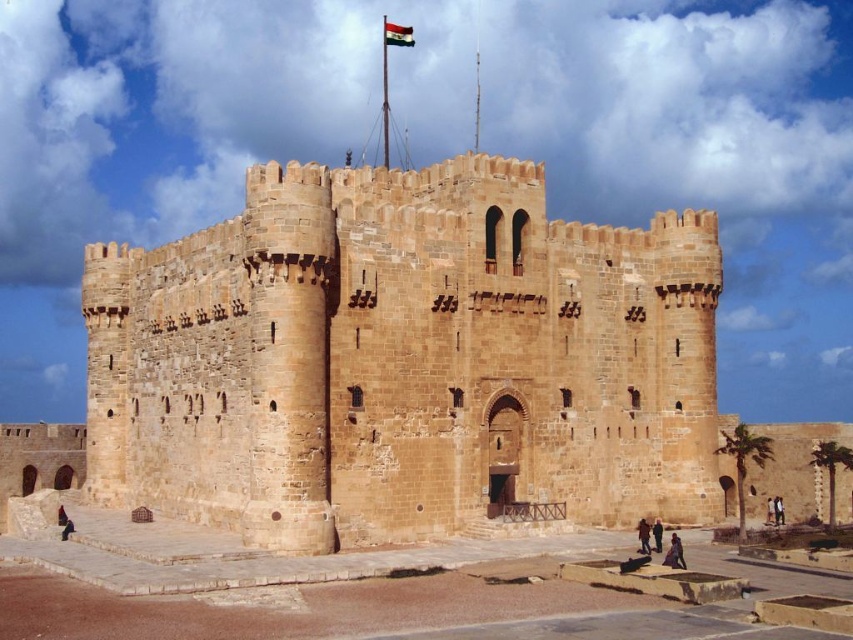
You are a visitor standing at the base of the fortress. You want to take a photo of the polyester flag at upper center without including the brown stone fort at center in the frame. Is this possible given their positions?

The brown stone fort at center is positioned on the right side of the polyester flag at upper center, so the fort is to the right of the flag. Since you want to exclude the fort from the photo, you can position yourself to the left side of the flag to capture it without the fort in the frame.

You are standing in front of the fortress and want to determine which of the two points, point [657,448] or point [405,35], is closer to you. Based on the fortress structure, can you identify which point is nearer?

Point [657,448] is closer to the camera than point [405,35], so it is the nearer point.

You are a drone operator trying to capture the entire brown stone fort at center and the polyester flag at upper center in one photo. Given that the camera has a fixed focal length, which object should you prioritize framing first to ensure both are in the frame?

The brown stone fort at center is wider than the polyester flag at upper center, so you should prioritize framing the brown stone fort at center first to ensure both fit in the frame.